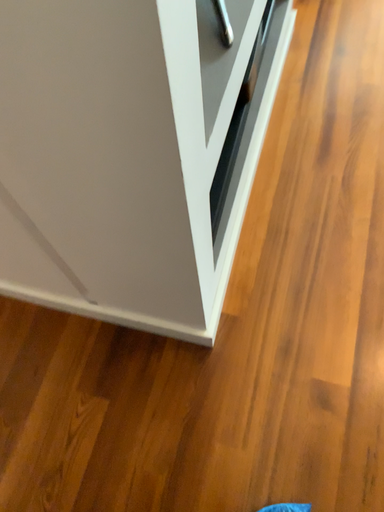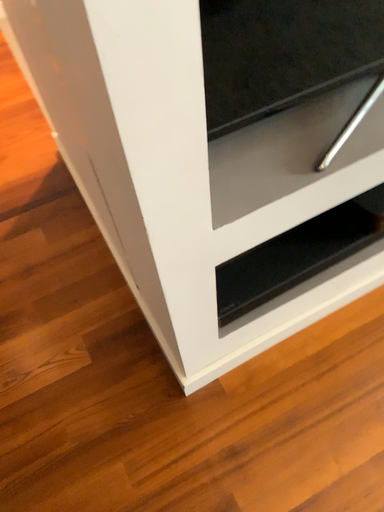
Question: Which way did the camera rotate in the video?

Choices:
 (A) rotated upward
 (B) rotated downward

Answer: (A)